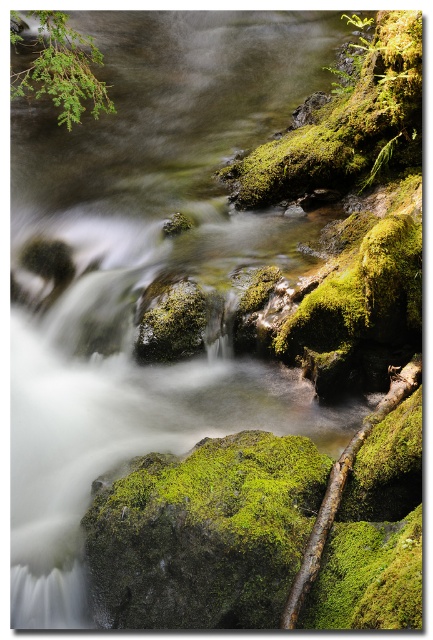
Question: Which point is closer to the camera taking this photo?

Choices:
 (A) (19, 88)
 (B) (410, 80)

Answer: (B)

Question: Is green mossy rock at upper right below green leafy branch at upper left?

Choices:
 (A) no
 (B) yes

Answer: (B)

Question: Which object is closer to the camera taking this photo?

Choices:
 (A) green leafy branch at upper left
 (B) green mossy rock at upper right

Answer: (B)

Question: Is green mossy rock at upper right to the right of green leafy branch at upper left from the viewer's perspective?

Choices:
 (A) no
 (B) yes

Answer: (B)

Question: Is green mossy rock at upper right closer to the viewer compared to green leafy branch at upper left?

Choices:
 (A) yes
 (B) no

Answer: (A)